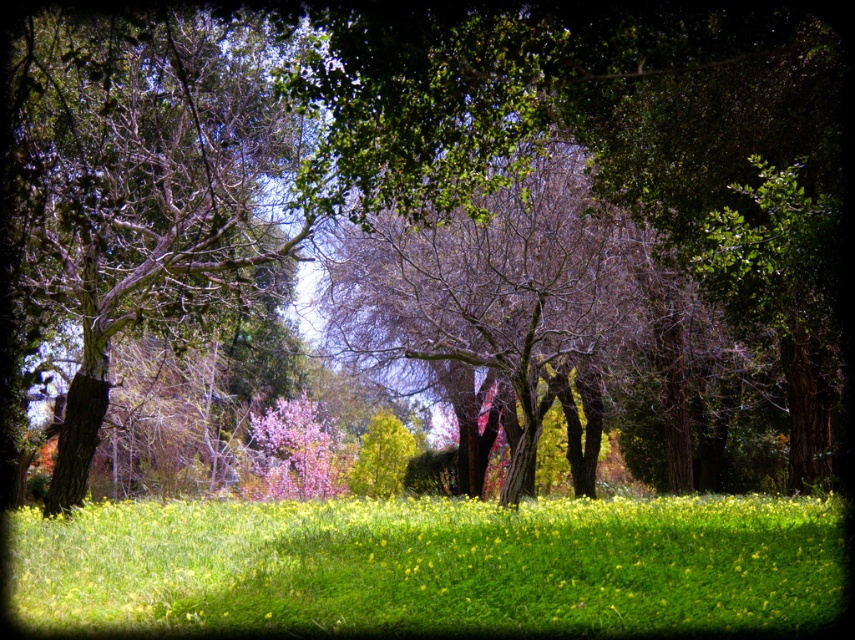
You are planning to place a small garden statue between the smooth bark tree at left and the pink silky blossoms at center. Considering their sizes, which object should the statue be closer to?

The smooth bark tree at left is larger in size than the pink silky blossoms at center, so the statue should be placed closer to the pink silky blossoms at center to balance the composition.